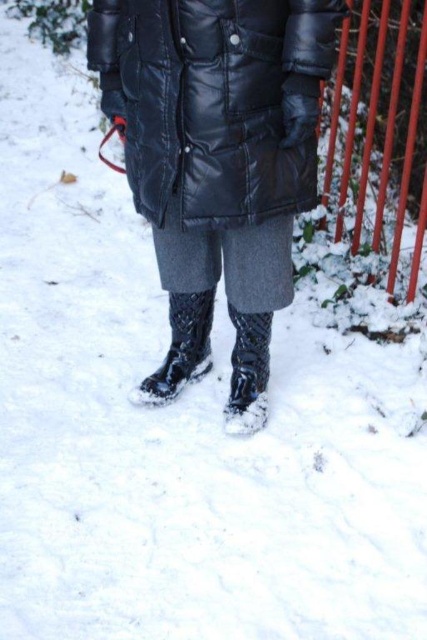
You are a fashion designer observing the snowy scene. You need to determine which item of clothing is bigger in size between the black leather jacket at center and the glossy rubber boot at center. Which one is larger?

The black leather jacket at center has a larger size compared to the glossy rubber boot at center, so the black leather jacket at center is larger.

You are a photographer aiming to capture the black leather jacket at center in your shot. The camera is positioned at the origin point. Which direction should you move the camera to focus on the jacket?

The black leather jacket at center is located at point (216, 100). Since the coordinates are relative to the image frame, moving the camera slightly to the right and upwards would center the jacket in the shot.

You are trying to decide which boot to wear for a walk in the snow. You have two options in front of you on the ground. The glossy rubber boot at center and the glossy black boot at lower center. Which one is shorter?

The glossy rubber boot at center is shorter than the glossy black boot at lower center.